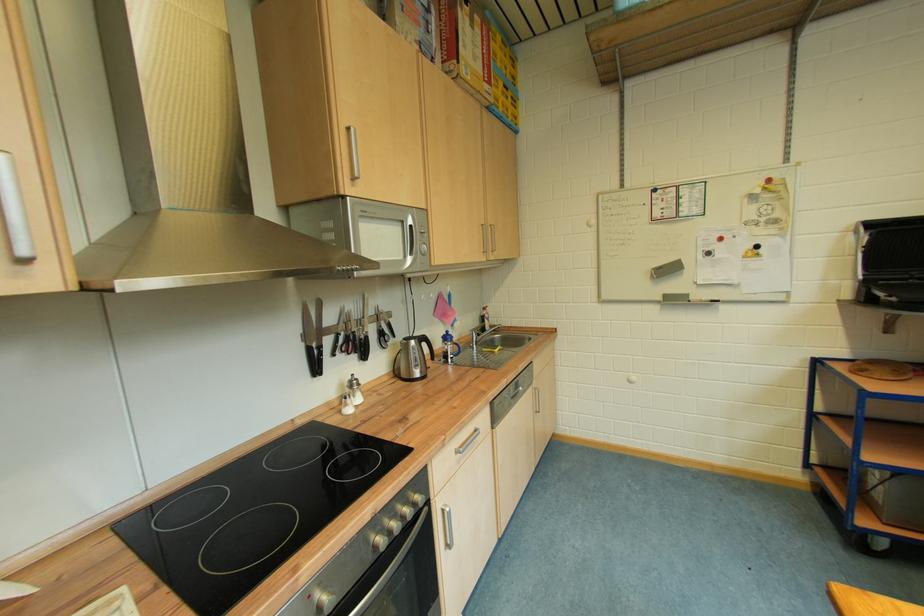
Find the location of `whiteboard eraser`. whiteboard eraser is located at coordinates click(x=666, y=269).